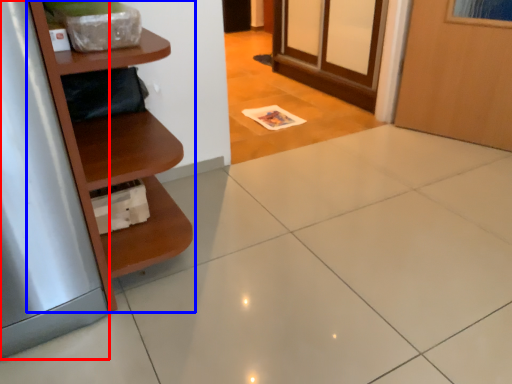
Question: Which object appears farthest to the camera in this image, silver (highlighted by a red box) or shelf (highlighted by a blue box)?

Choices:
 (A) silver
 (B) shelf

Answer: (B)